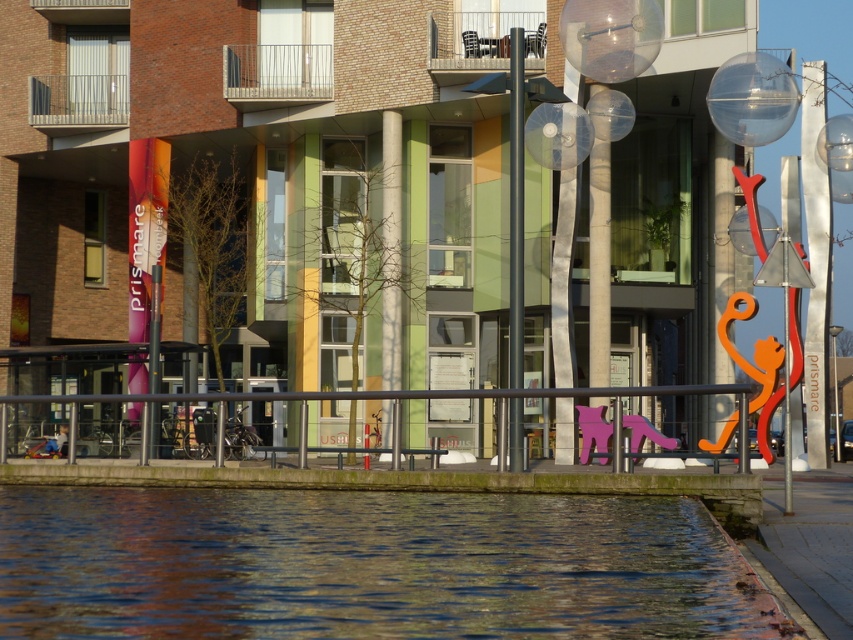
From the picture: You are a city planner reviewing this urban design. You notice the clear water at lower left and the black metal rail at lower center. Which of these two elements takes up more visual space in the scene?

The black metal rail at lower center occupies more visual space than the clear water at lower left according to the description.

You are standing at the edge of the sidewalk and want to reach the water. According to the image, where is the black metal rail at lower center located?

The black metal rail at lower center is located at point (352, 397).

You are standing at the edge of the sidewalk near the metal railing. You see a point marked at coordinates (369,564). Based on the scene, where is this point located?

The point at (369,564) is on clear water at lower left.